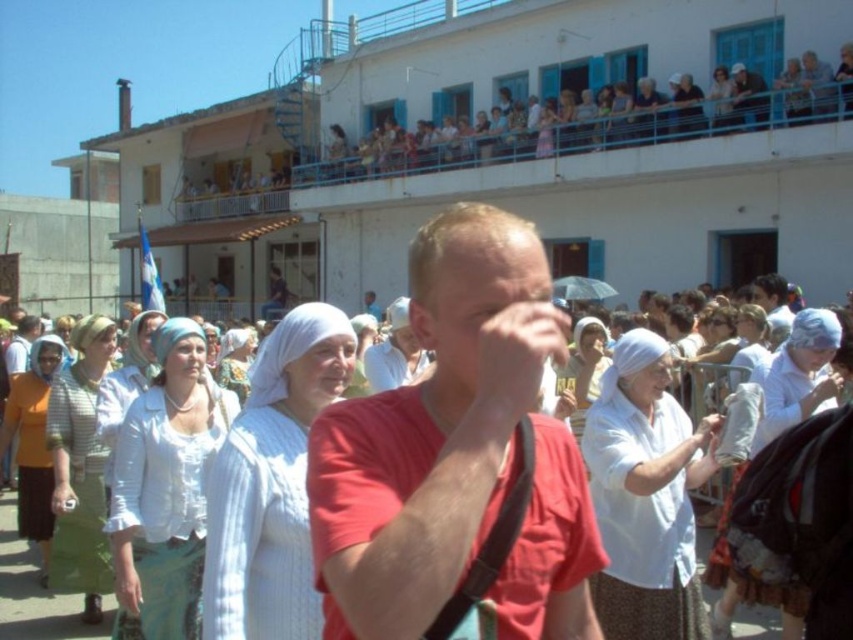
Question: Is red matte shirt at center thinner than white cloth-covered heads at upper center?

Choices:
 (A) no
 (B) yes

Answer: (B)

Question: Which of the following is the farthest from the observer?

Choices:
 (A) red matte shirt at center
 (B) white cloth-covered heads at upper center

Answer: (B)

Question: Is red matte shirt at center in front of white cloth-covered heads at upper center?

Choices:
 (A) yes
 (B) no

Answer: (A)

Question: In this image, where is red matte shirt at center located relative to white cloth-covered heads at upper center?

Choices:
 (A) above
 (B) below

Answer: (B)

Question: Which object appears farthest from the camera in this image?

Choices:
 (A) red matte shirt at center
 (B) white cloth-covered heads at upper center

Answer: (B)